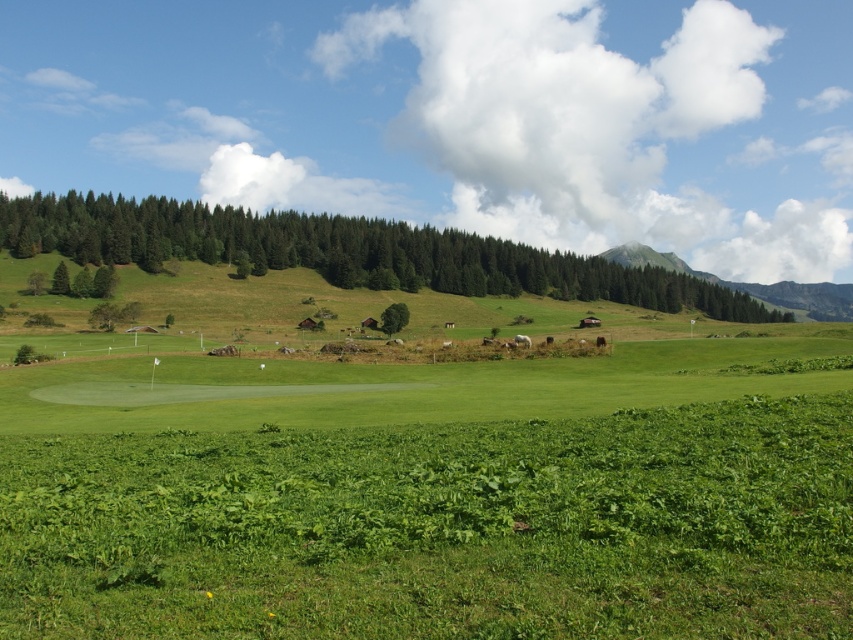
You are a hiker planning to take a photo of the green matte trees at upper left and the green grassy mountain at upper center. Which object would appear smaller in your camera frame?

The green matte trees at upper left would appear smaller in the camera frame because they are smaller in size compared to the green grassy mountain at upper center.